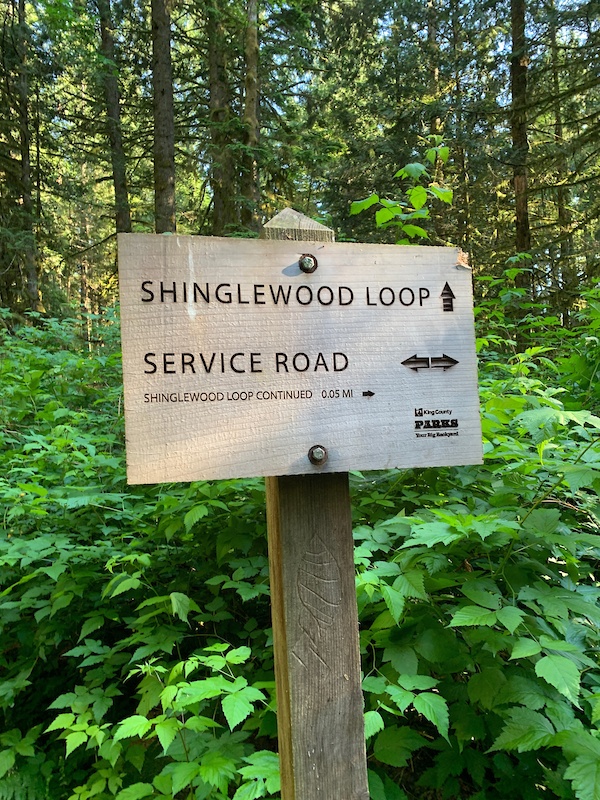
At what (x,y) coordinates should I click in order to perform the action: click on leafy green plants. Please return your answer as a coordinate pair (x, y). This screenshot has width=600, height=800. Looking at the image, I should click on (450, 554), (186, 590), (183, 698), (202, 750), (528, 648), (60, 518), (45, 422).